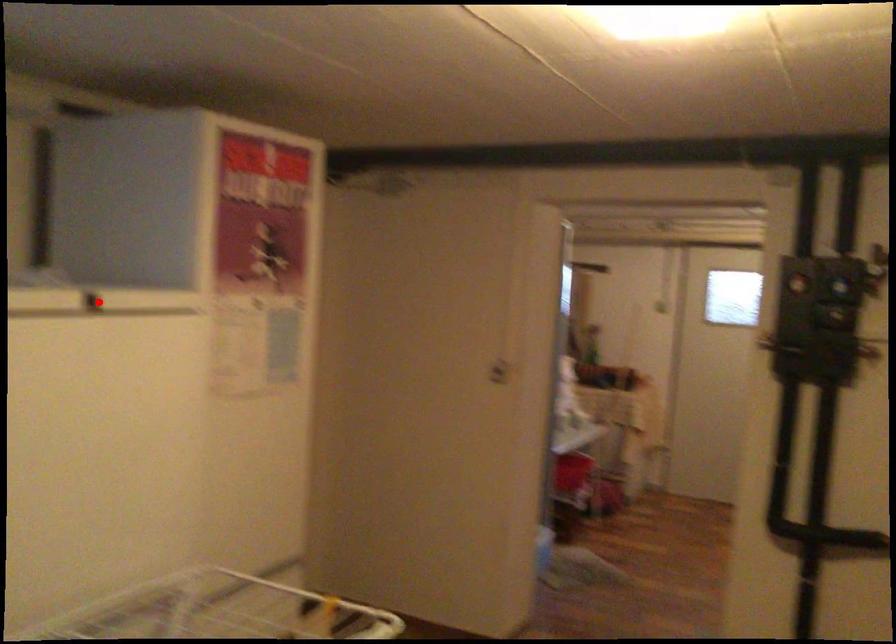
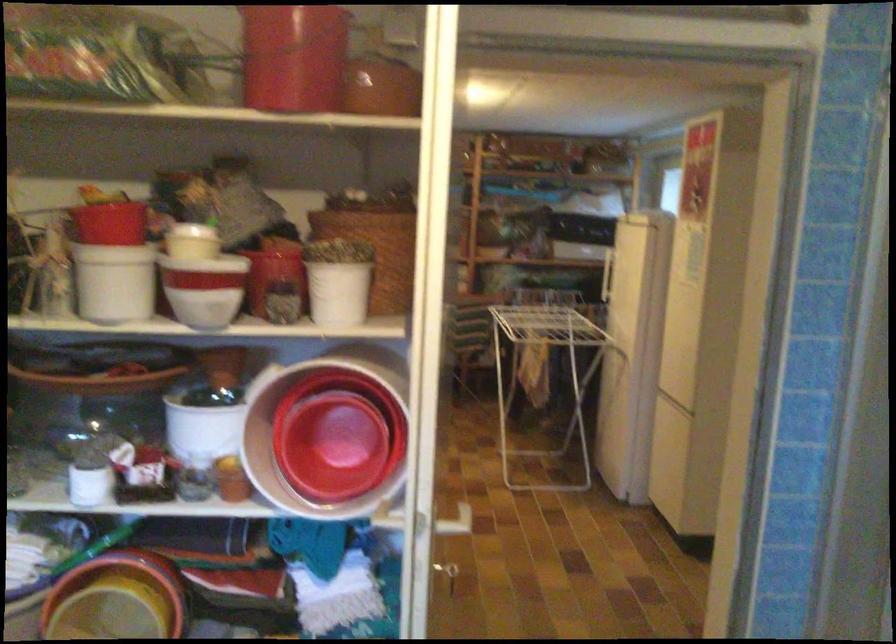
Question: I am providing you with two images of the same scene from different viewpoints. A red point is marked on the first image. At the location where the point appears in image 1, is it still visible in image 2?

Choices:
 (A) Yes
 (B) No

Answer: (B)